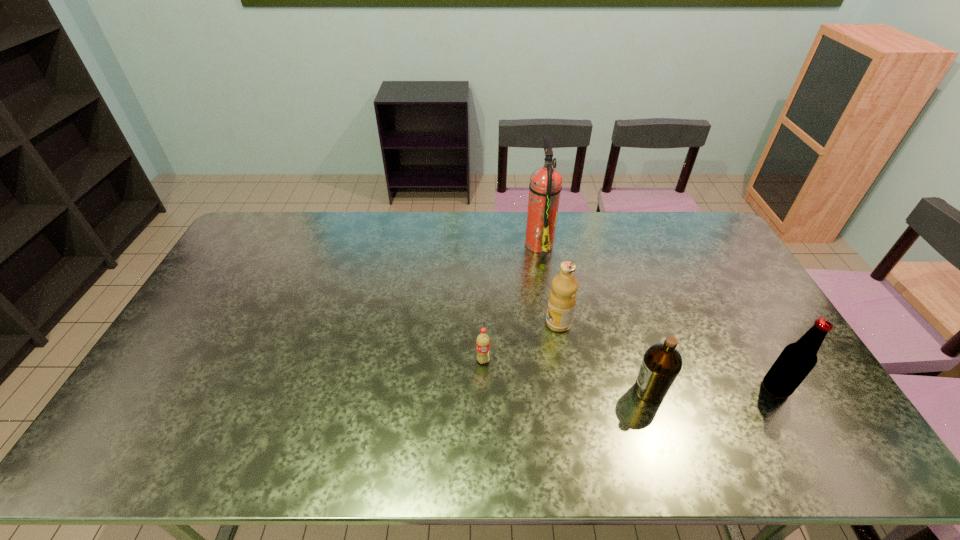
This screenshot has width=960, height=540. What are the coordinates of `free space located 0.310m at the nozzle of the farthest object` in the screenshot? It's located at (441, 243).

The image size is (960, 540). What are the coordinates of `vacant space located 0.080m at the nozzle of the farthest object` in the screenshot? It's located at (503, 243).

Where is `vacant region located 0.090m on the back of the beer bottle`? The height and width of the screenshot is (540, 960). vacant region located 0.090m on the back of the beer bottle is located at coordinates (755, 350).

This screenshot has width=960, height=540. I want to click on vacant space positioned on the label of the second farthest object, so click(467, 323).

At what (x,y) coordinates should I click in order to perform the action: click on free space located on the label of the second farthest object. Please return your answer as a coordinate pair (x, y). Looking at the image, I should click on (447, 323).

Where is `vacant space located 0.150m on the label of the second farthest object`? The width and height of the screenshot is (960, 540). vacant space located 0.150m on the label of the second farthest object is located at coordinates (496, 323).

The width and height of the screenshot is (960, 540). I want to click on vacant space located on the label of the second object from right to left, so (x=599, y=390).

Identify the location of free spot located on the label of the second object from right to left. The width and height of the screenshot is (960, 540). (491, 390).

Identify the location of vacant space positioned on the label of the second object from right to left. (546, 390).

Find the location of a particular element. The image size is (960, 540). vacant space located on the left of the leftmost object is located at coordinates (447, 360).